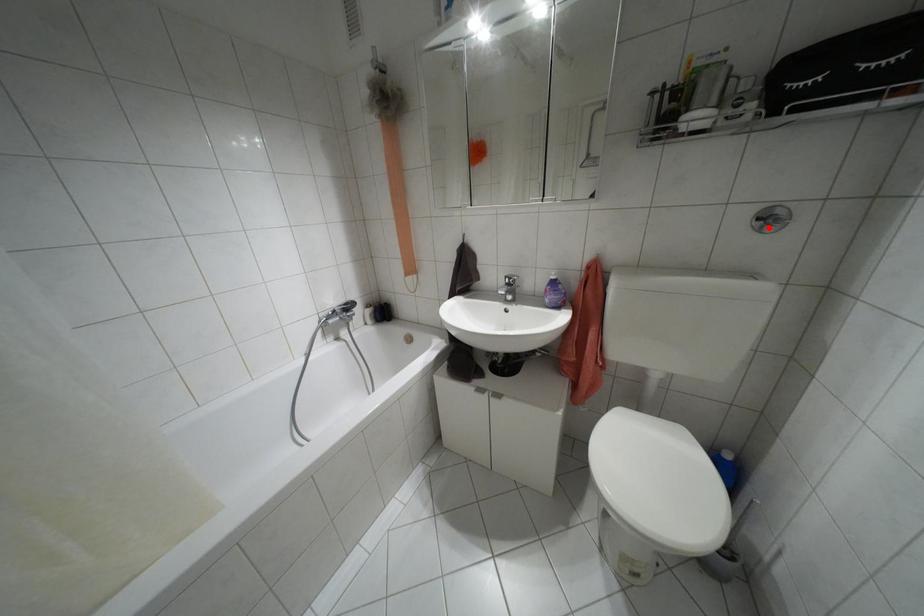
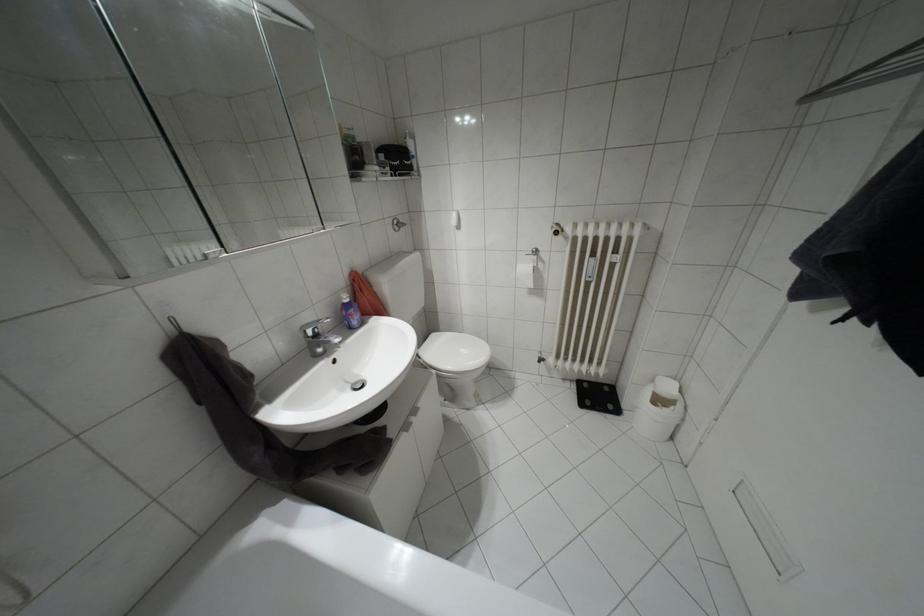
Question: I am providing you with two images of the same scene from different viewpoints. A red point is shown in image1. For the corresponding object point in image2, is it positioned nearer or farther from the camera?

Choices:
 (A) Nearer
 (B) Farther

Answer: (A)